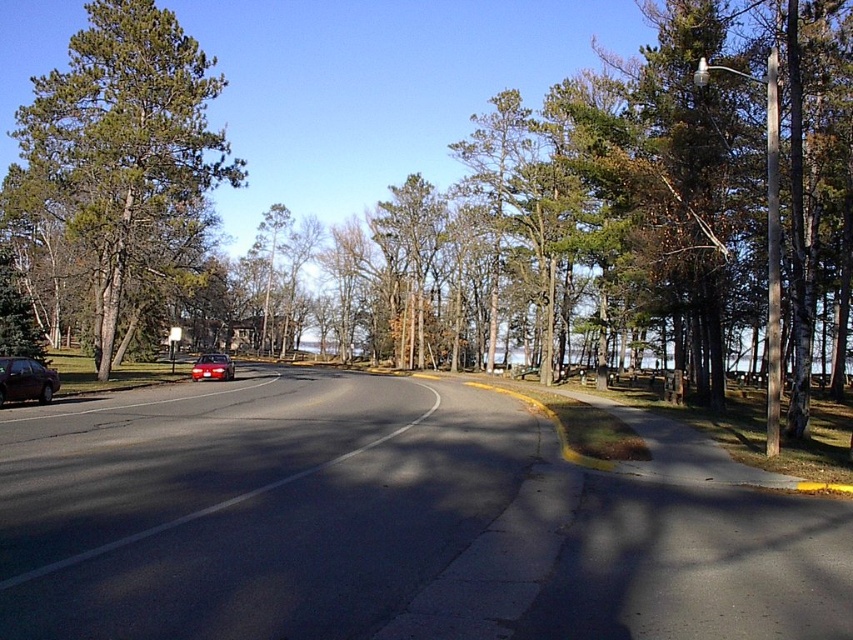
Which is above, shiny dark brown sedan at left or shiny red car at center?

shiny dark brown sedan at left is higher up.

Image resolution: width=853 pixels, height=640 pixels. What are the coordinates of `shiny dark brown sedan at left` in the screenshot? It's located at (25, 380).

Between point (36, 396) and point (206, 353), which one is positioned in front?

Point (36, 396) is in front.

In order to click on shiny dark brown sedan at left in this screenshot , I will do `click(25, 380)`.

Which of these two, green matte tree at left or shiny dark brown sedan at left, stands taller?

With more height is green matte tree at left.

Does green matte tree at left appear on the right side of shiny dark brown sedan at left?

In fact, green matte tree at left is to the left of shiny dark brown sedan at left.

What do you see at coordinates (126, 150) in the screenshot? The image size is (853, 640). I see `green matte tree at left` at bounding box center [126, 150].

Identify the location of green matte tree at left. The width and height of the screenshot is (853, 640). (126, 150).

Describe the element at coordinates (126, 150) in the screenshot. I see `green matte tree at left` at that location.

Can you confirm if green matte tree at left is thinner than shiny red car at center?

Incorrect, green matte tree at left's width is not less than shiny red car at center's.

Is point (90, 17) positioned before point (204, 364)?

No, it is behind (204, 364).

Identify the location of green matte tree at left. (126, 150).